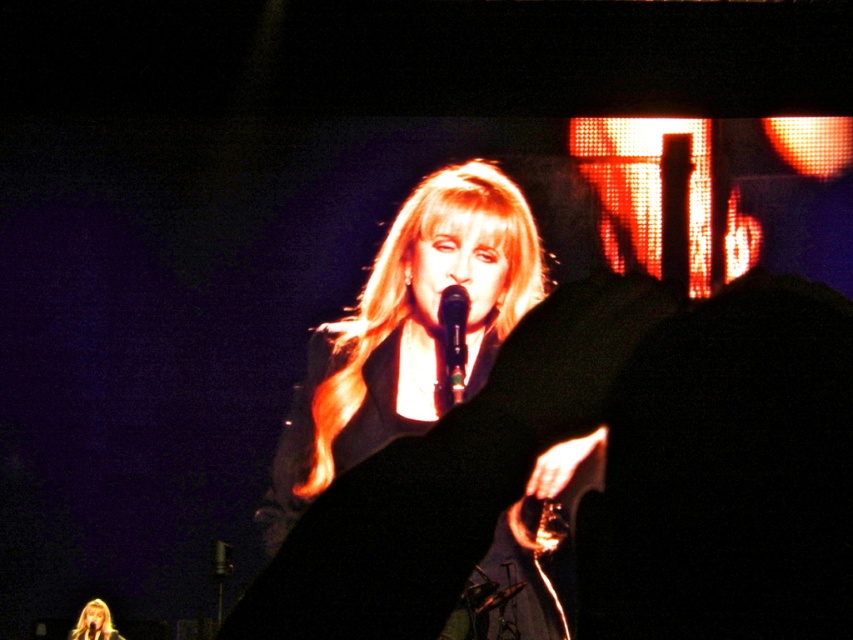
Does blondehair at center have a larger size compared to smooth blonde hair at center?

Correct, blondehair at center is larger in size than smooth blonde hair at center.

Which is more to the left, blondehair at center or smooth blonde hair at center?

smooth blonde hair at center is more to the left.

Who is more forward, [442,189] or [80,624]?

Point [80,624]

The image size is (853, 640). What are the coordinates of `blondehair at center` in the screenshot? It's located at (408, 288).

Can you confirm if blondehair at center is positioned to the right of shiny black microphone at center?

No, blondehair at center is not to the right of shiny black microphone at center.

Describe the element at coordinates (408, 288) in the screenshot. I see `blondehair at center` at that location.

At what (x,y) coordinates should I click in order to perform the action: click on blondehair at center. Please return your answer as a coordinate pair (x, y). This screenshot has width=853, height=640. Looking at the image, I should click on (408, 288).

Between point (462, 316) and point (86, 612), which one is positioned in front?

Positioned in front is point (462, 316).

Does point (444, 332) lie behind point (100, 609)?

No, it is not.

Locate an element on the screen. The height and width of the screenshot is (640, 853). shiny black microphone at center is located at coordinates (451, 346).